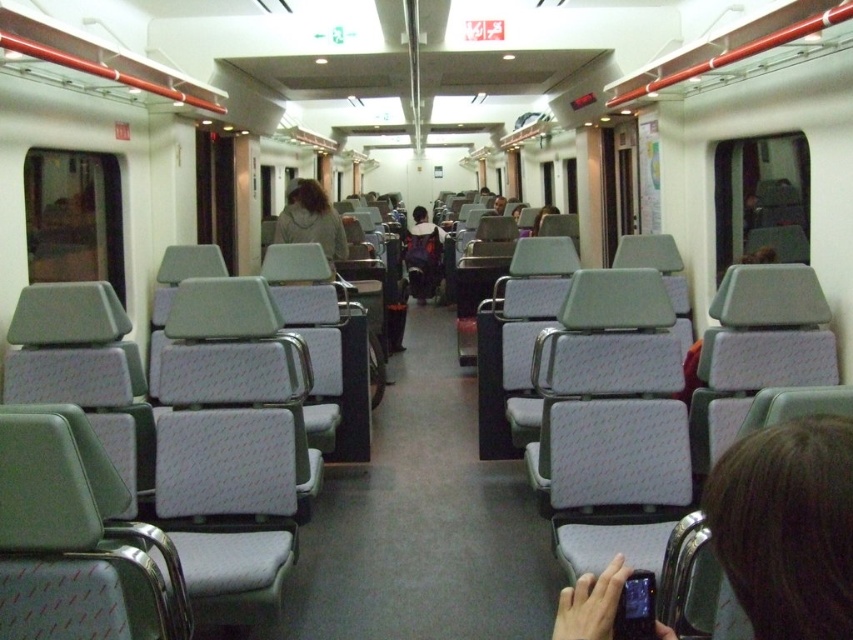
Question: Considering the relative positions of gray fabric seat at lower right and matte gray seat at right in the image provided, where is gray fabric seat at lower right located with respect to matte gray seat at right?

Choices:
 (A) left
 (B) right

Answer: (A)

Question: Can you confirm if dark gray fabric backpack at center is bigger than matte gray seat at right?

Choices:
 (A) no
 (B) yes

Answer: (B)

Question: Does light gray fabric jacket at center have a larger size compared to dark gray fabric backpack at center?

Choices:
 (A) no
 (B) yes

Answer: (A)

Question: Which object is closer to the camera taking this photo?

Choices:
 (A) gray fabric seat at lower right
 (B) dark gray fabric backpack at center

Answer: (A)

Question: Which object is the closest to the dark gray fabric backpack at center?

Choices:
 (A) gray fabric seat at lower right
 (B) matte gray seat at right

Answer: (B)

Question: Estimate the real-world distances between objects in this image. Which object is farther from the light gray fabric jacket at center?

Choices:
 (A) matte gray seat at right
 (B) gray fabric seat at lower right
 (C) dark gray fabric backpack at center

Answer: (C)